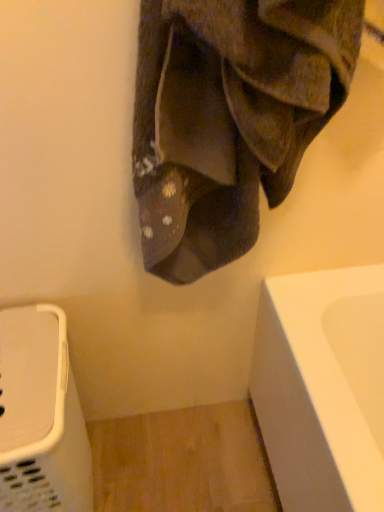
Where is `empty space that is ontop of white plastic laundry basket at lower left (from a real-world perspective)`? The image size is (384, 512). empty space that is ontop of white plastic laundry basket at lower left (from a real-world perspective) is located at coordinates (21, 354).